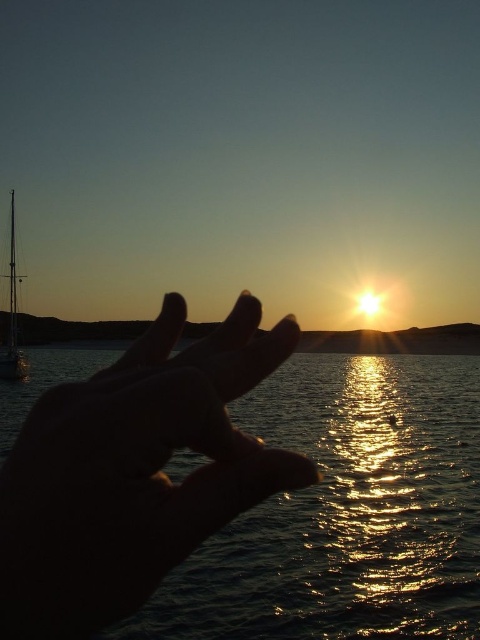
Question: In this image, where is silky skin hand at center located relative to shiny metallic sailboat at left?

Choices:
 (A) right
 (B) left

Answer: (A)

Question: Which point is closer to the camera?

Choices:
 (A) (19, 461)
 (B) (195, 324)
 (C) (8, 353)

Answer: (A)

Question: Which point appears closest to the camera in this image?

Choices:
 (A) click(x=27, y=330)
 (B) click(x=186, y=371)
 (C) click(x=12, y=230)

Answer: (B)

Question: Does silky skin hand at center lie behind shiny metallic sailboat at left?

Choices:
 (A) no
 (B) yes

Answer: (A)

Question: Which of these objects is positioned closest to the shiny metallic sailboat at left?

Choices:
 (A) smooth sand horizon at center
 (B) silky skin hand at center

Answer: (A)

Question: Does silky skin hand at center appear over smooth sand horizon at center?

Choices:
 (A) no
 (B) yes

Answer: (B)